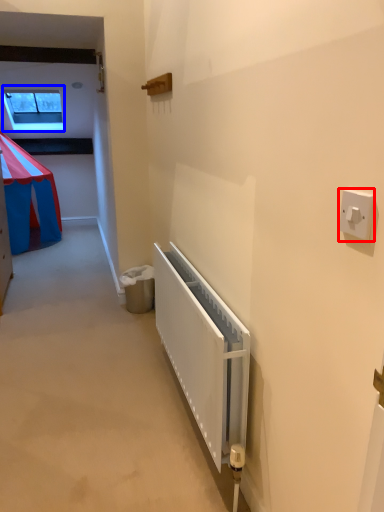
Question: Which object appears farthest to the camera in this image, light switch (highlighted by a red box) or window (highlighted by a blue box)?

Choices:
 (A) light switch
 (B) window

Answer: (B)